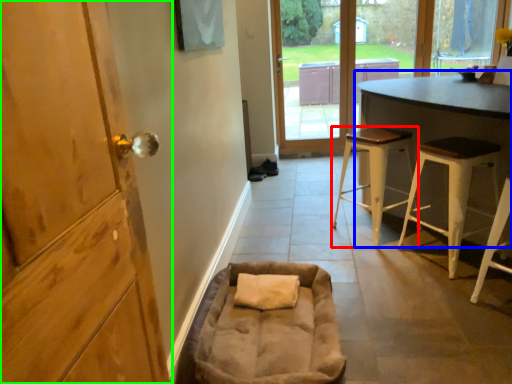
Question: Estimate the real-world distances between objects in this image. Which object is closer to stool (highlighted by a red box), table (highlighted by a blue box) or door (highlighted by a green box)?

Choices:
 (A) table
 (B) door

Answer: (A)